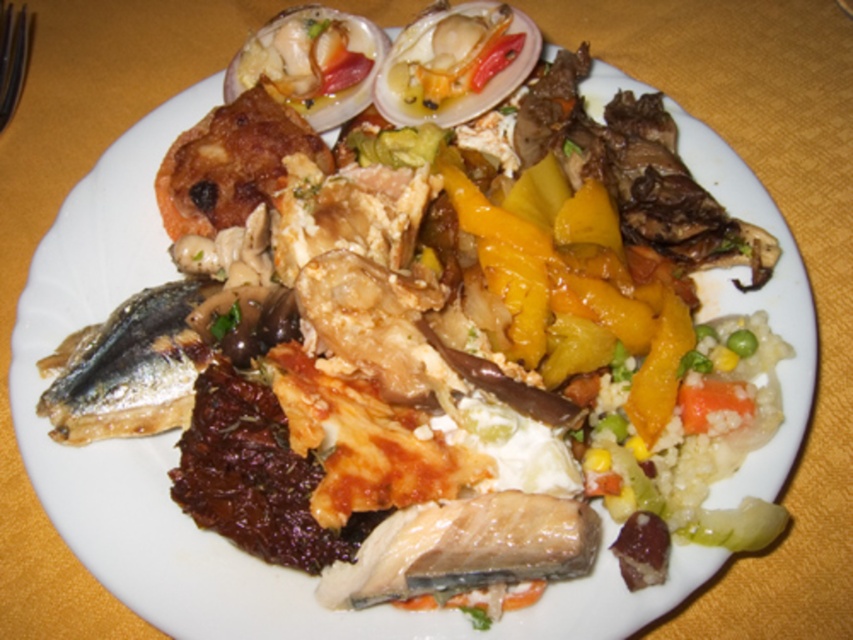
You are looking at the plate from directly above. The center of the plate is at coordinate point 0.5, 0.5. Where is the shiny silver fish at left located relative to the center of the plate?

The shiny silver fish at left is located to the left and slightly below the center of the plate because its coordinates are at 0.577 on the x axis and 0.151 on the y axis, which is less than the center point of 0.5 on the y axis.

You are a food critic observing the plate. Which object is closer to you between the shiny silver fish at left and the shiny white shellfish at upper center?

The shiny silver fish at left is closer to you because it is in front of the shiny white shellfish at upper center.

You are standing at the point marked as point (196, 337) and want to reach the entrance door located at the opposite side of the room. If the maximum distance you can walk is 4 feet, will you be able to reach the door?

The distance between you and the entrance door is 3.76 feet, which is within your maximum walking distance of 4 feet. Therefore, you can reach the door.